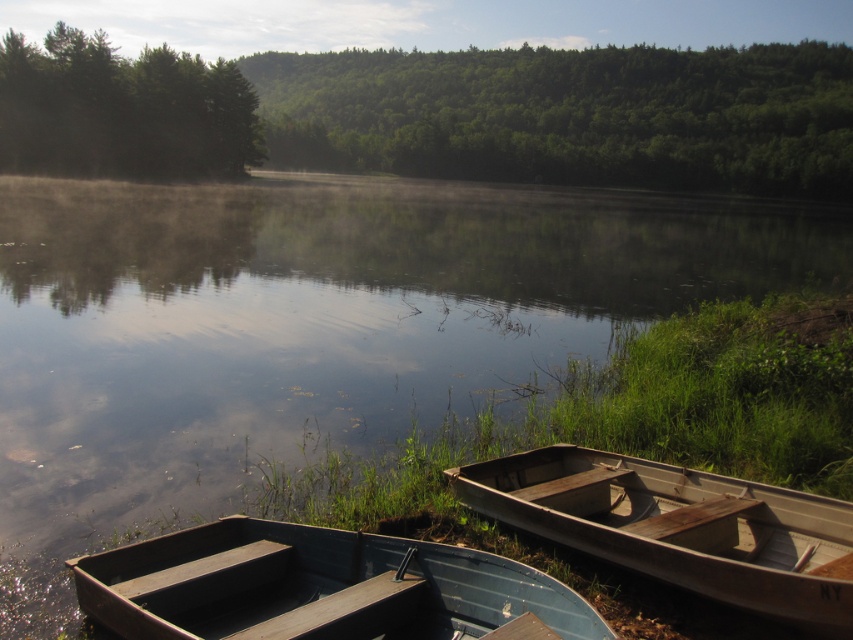
Is clear water at lower left shorter than green leafy forest at upper center?

Correct, clear water at lower left is not as tall as green leafy forest at upper center.

Is clear water at lower left smaller than green leafy forest at upper center?

Yes.

Where is `clear water at lower left`? This screenshot has width=853, height=640. clear water at lower left is located at coordinates (312, 328).

Locate an element on the screen. Image resolution: width=853 pixels, height=640 pixels. clear water at lower left is located at coordinates (312, 328).

Who is more forward, (180, 396) or (308, 576)?

Point (308, 576)

The width and height of the screenshot is (853, 640). Describe the element at coordinates (312, 328) in the screenshot. I see `clear water at lower left` at that location.

What do you see at coordinates (312, 328) in the screenshot? The height and width of the screenshot is (640, 853). I see `clear water at lower left` at bounding box center [312, 328].

You are a GUI agent. You are given a task and a screenshot of the screen. Output one action in this format:
    pyautogui.click(x=<x>, y=<y>)
    Task: Click on the clear water at lower left
    
    Given the screenshot: What is the action you would take?
    pos(312,328)

Who is more distant from viewer, (x=845, y=148) or (x=463, y=488)?

The point (x=845, y=148) is behind.

Does green leafy forest at upper center appear on the left side of wooden canoe at lower right?

No, green leafy forest at upper center is not to the left of wooden canoe at lower right.

Is point (389, 136) positioned before point (793, 524)?

No, it is behind (793, 524).

This screenshot has width=853, height=640. I want to click on green leafy forest at upper center, so [570, 115].